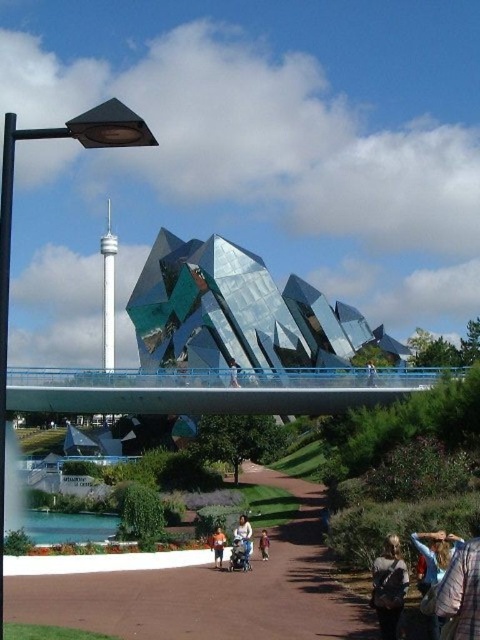
In the scene shown: You are standing at the entrance of the modern building and want to reach the brown dirt path at lower center. According to the coordinates provided, where exactly should you look to find the path?

The brown dirt path at lower center is located at point (x=201, y=588).

You are standing at the entrance of the modern building and notice a white cotton shirt at center. If you walk straight ahead along the pathway, will the shirt remain in your line of sight?

The white cotton shirt at center is located at point [242,538], so if you walk straight ahead along the pathway, the shirt will remain in your line of sight as it is centrally positioned.